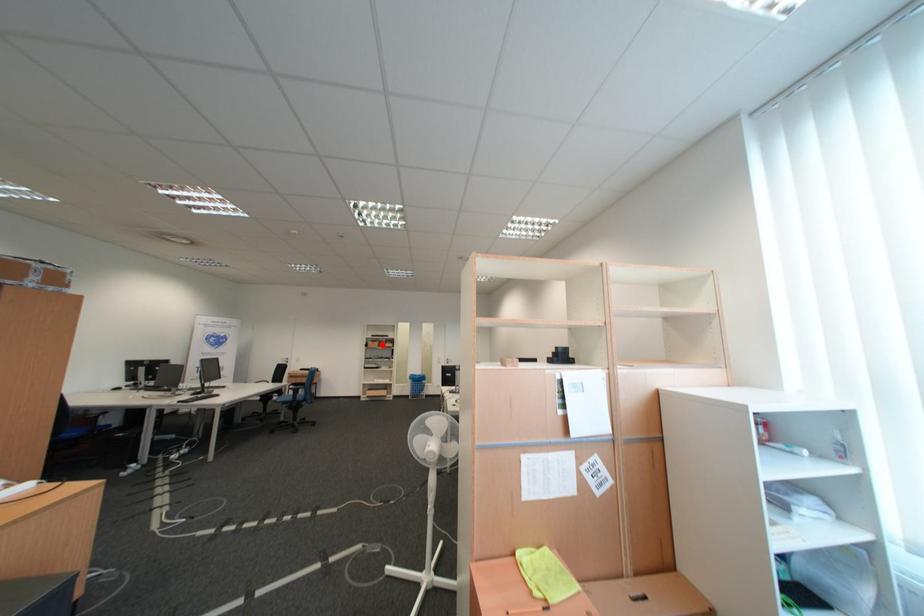
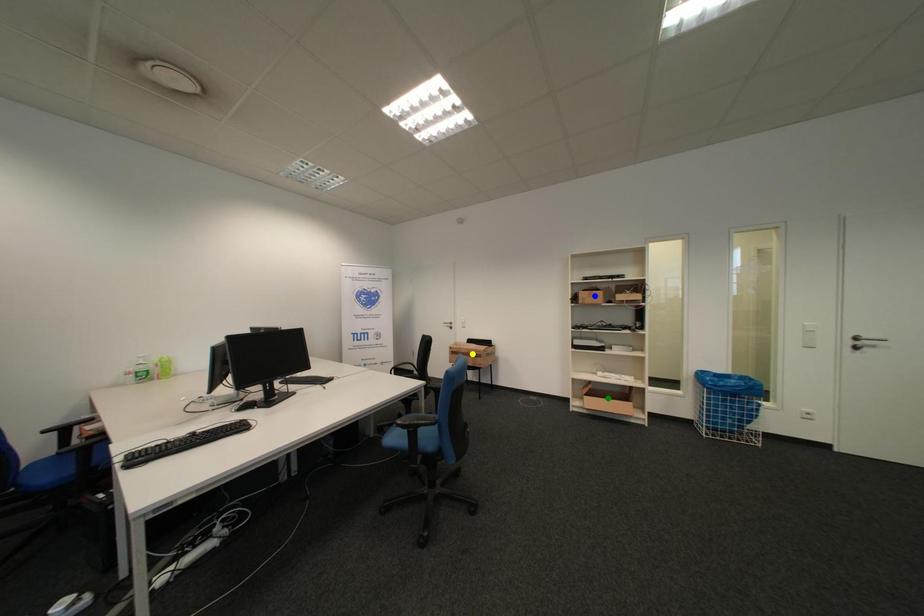
Question: I am providing you with two images of the same scene from different viewpoints. A red point is marked on the first image. You are given multiple points on the second image. Can you choose the point in image 2 that corresponds to the point in image 1?

Choices:
 (A) yellow point
 (B) blue point
 (C) green point

Answer: (B)